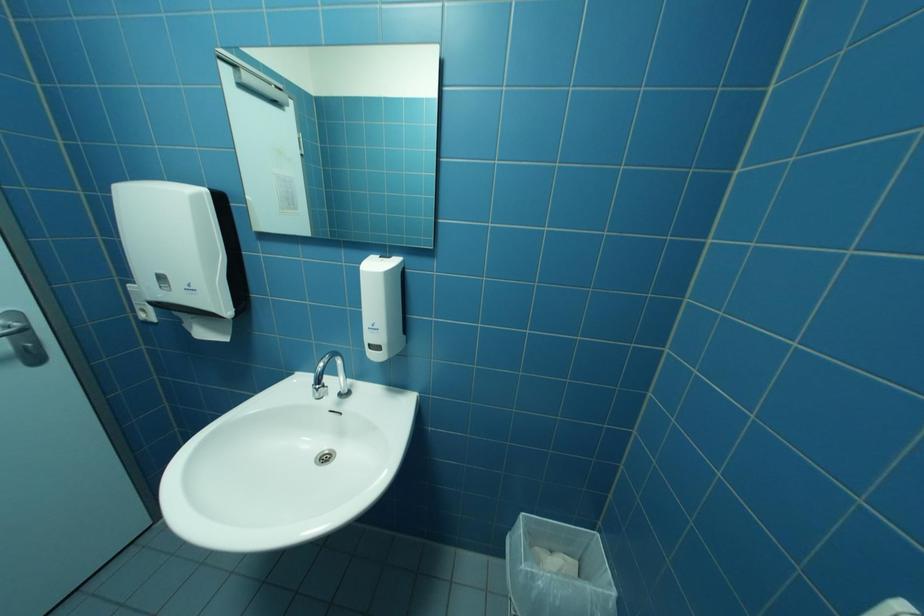
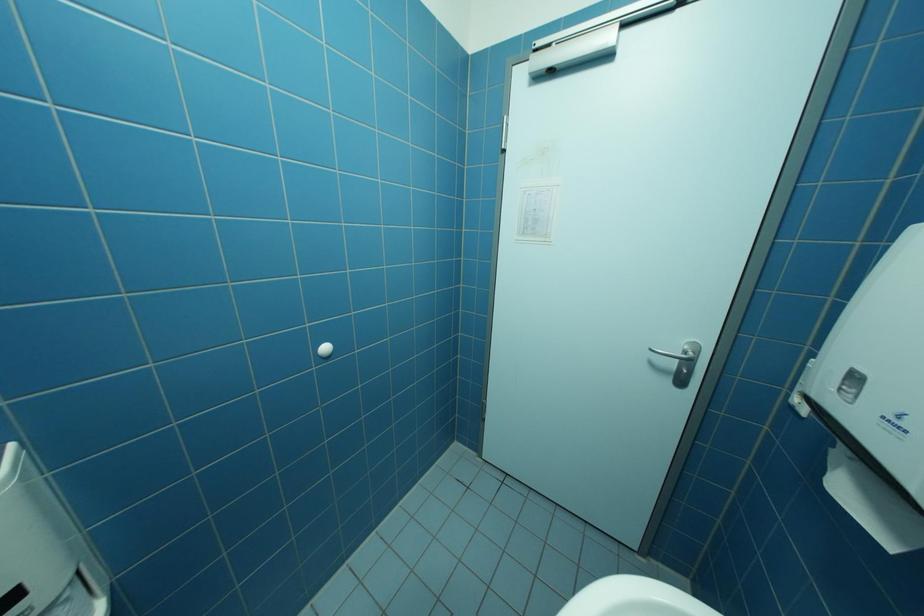
Based on the photo, the first image is from the beginning of the video and the second image is from the end. How did the camera likely rotate when shooting the video?

The rotation direction of the camera is left-down.